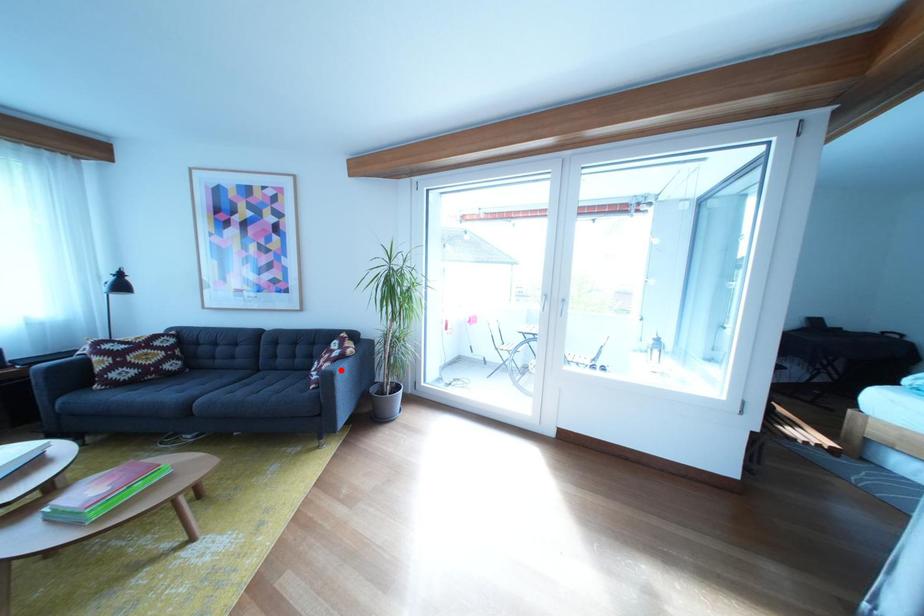
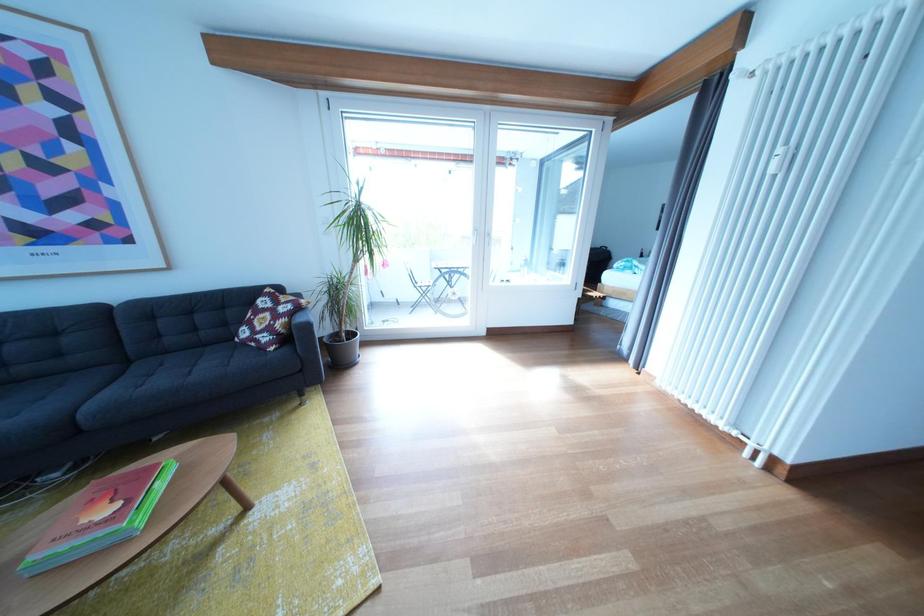
The point at the highlighted location is marked in the first image. Where is the corresponding point in the second image?

(296, 326)